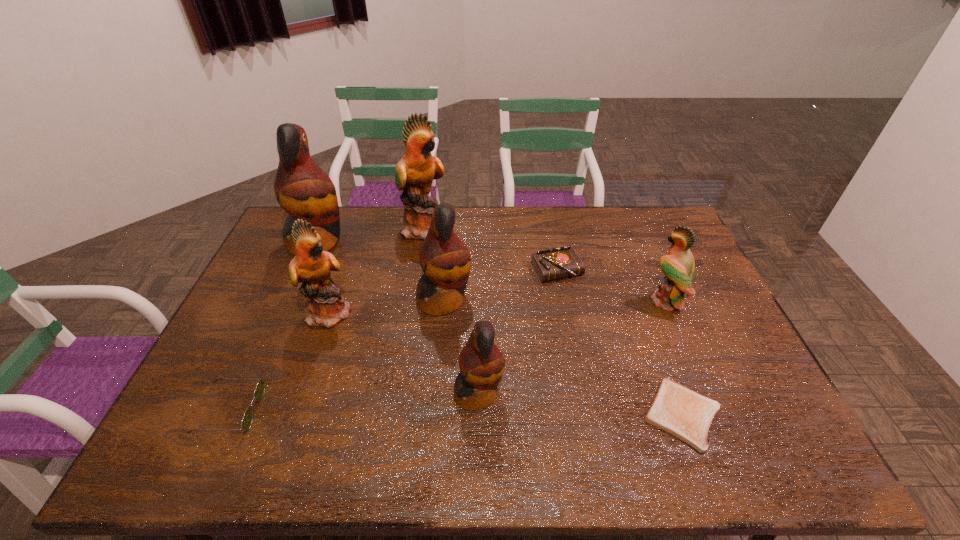
Image resolution: width=960 pixels, height=540 pixels. Identify the location of the biggest green parrot. (415, 172).

Locate an element on the screen. the second green parrot from right to left is located at coordinates (415, 172).

The height and width of the screenshot is (540, 960). Identify the location of the biggest red parrot. (302, 189).

This screenshot has height=540, width=960. Identify the location of the leftmost red parrot. 302,189.

Find the location of a particular element. The image size is (960, 540). the second smallest red parrot is located at coordinates (445, 260).

At what (x,y) coordinates should I click in order to perform the action: click on the leftmost green parrot. Please return your answer as a coordinate pair (x, y). This screenshot has height=540, width=960. Looking at the image, I should click on click(x=326, y=307).

What are the coordinates of `the rightmost green parrot` in the screenshot? It's located at (678, 266).

Identify the location of the smallest green parrot. (678, 266).

You are a GUI agent. You are given a task and a screenshot of the screen. Output one action in this format:
    pyautogui.click(x=<x>, y=<y>)
    Task: Click on the nearest parrot
    The image size is (960, 540).
    Given the screenshot: What is the action you would take?
    pyautogui.click(x=481, y=363)

This screenshot has height=540, width=960. I want to click on the smallest red parrot, so click(481, 363).